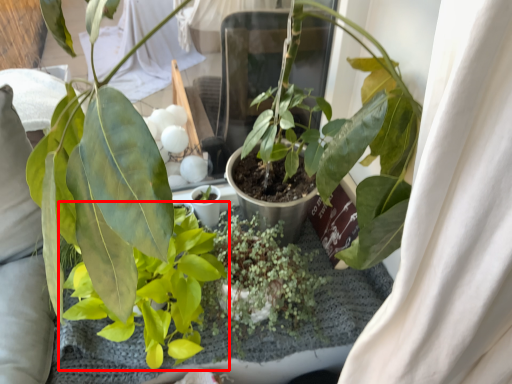
Question: From the image's perspective, where is houseplant (annotated by the red box) located in relation to houseplant in the image?

Choices:
 (A) above
 (B) below

Answer: (A)